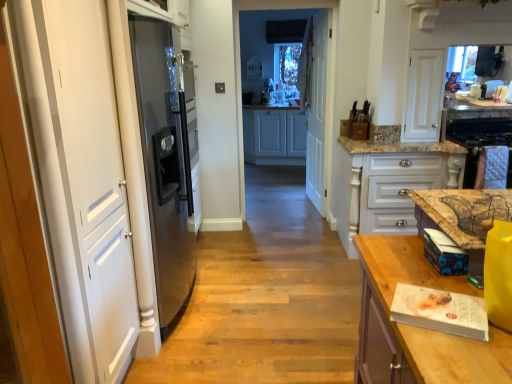
Measure the distance between brown marble countertop at right, which is the 2th countertop in bottom-to-top order, and camera.

brown marble countertop at right, which is the 2th countertop in bottom-to-top order, and camera are 1.49 meters apart from each other.

This screenshot has width=512, height=384. Describe the element at coordinates (480, 151) in the screenshot. I see `quilted fabric oven at right` at that location.

What do you see at coordinates (316, 108) in the screenshot?
I see `white wooden door at center` at bounding box center [316, 108].

Measure the distance between point (355, 219) and camera.

They are 3.46 meters apart.

You are a GUI agent. You are given a task and a screenshot of the screen. Output one action in this format:
    pyautogui.click(x=<x>, y=<y>)
    Task: Click on the brown marble countertop at right, which is the 2th countertop in bottom-to-top order
    This screenshot has height=384, width=512.
    Given the screenshot: What is the action you would take?
    pyautogui.click(x=463, y=212)

Would you say white wooden door at center is a long distance from white wood cabinets at center, the first cabinetry viewed from the left?

Yes, white wooden door at center and white wood cabinets at center, the first cabinetry viewed from the left, are quite far apart.

Considering the relative positions of white wooden door at center and white wood cabinets at center, the first cabinetry in the top-to-bottom sequence, in the image provided, is white wooden door at center behind white wood cabinets at center, the first cabinetry in the top-to-bottom sequence,?

No, white wooden door at center is in front of white wood cabinets at center, the first cabinetry in the top-to-bottom sequence.

How far apart are white wooden door at center and white wood cabinets at center, which appears as the 2th cabinetry when viewed from the front?

white wooden door at center is 1.58 meters from white wood cabinets at center, which appears as the 2th cabinetry when viewed from the front.

Does white wooden door at center have a larger size compared to white wood cabinets at center, the first cabinetry viewed from the left?

No, white wooden door at center is not bigger than white wood cabinets at center, the first cabinetry viewed from the left.

Which is behind, quilted fabric oven at right or wooden table at right, the second countertop from the top?

quilted fabric oven at right is behind.

Considering the positions of objects quilted fabric oven at right and wooden table at right, which is the 1th countertop in bottom-to-top order, in the image provided, who is more to the left, quilted fabric oven at right or wooden table at right, which is the 1th countertop in bottom-to-top order,?

From the viewer's perspective, wooden table at right, which is the 1th countertop in bottom-to-top order, appears more on the left side.

Who is bigger, quilted fabric oven at right or wooden table at right, the second countertop from the top?

With larger size is wooden table at right, the second countertop from the top.

Consider the image. From a real-world perspective, relative to wooden table at right, the second countertop from the top, is quilted fabric oven at right vertically above or below?

quilted fabric oven at right is situated higher than wooden table at right, the second countertop from the top, in the real world.

Would you consider white wood cabinets at center, marked as the 2th cabinetry in a bottom-to-top arrangement, to be distant from brown marble countertop at right, which is the 2th countertop in bottom-to-top order?

Absolutely, white wood cabinets at center, marked as the 2th cabinetry in a bottom-to-top arrangement, is distant from brown marble countertop at right, which is the 2th countertop in bottom-to-top order.

Which point is more distant from viewer, (x=258, y=161) or (x=484, y=193)?

A: Positioned behind is point (x=258, y=161).

Based on the photo, is white wood cabinets at center, the first cabinetry viewed from the left, shorter than brown marble countertop at right, which is the 2th countertop in bottom-to-top order?

Incorrect, the height of white wood cabinets at center, the first cabinetry viewed from the left, does not fall short of that of brown marble countertop at right, which is the 2th countertop in bottom-to-top order.

Can you confirm if white wood cabinets at center, which appears as the 2th cabinetry when viewed from the front, is thinner than brown marble countertop at right, the 1th countertop positioned from the top?

In fact, white wood cabinets at center, which appears as the 2th cabinetry when viewed from the front, might be wider than brown marble countertop at right, the 1th countertop positioned from the top.

From the picture: From the image's perspective, is white glossy cabinet at center, the first cabinetry positioned from the right, on top of white wood cabinets at center, marked as the 2th cabinetry in a bottom-to-top arrangement?

No, from the image's perspective, white glossy cabinet at center, the first cabinetry positioned from the right, is not on top of white wood cabinets at center, marked as the 2th cabinetry in a bottom-to-top arrangement.

Which object is positioned more to the right, white glossy cabinet at center, the first cabinetry positioned from the right, or white wood cabinets at center, the first cabinetry in the top-to-bottom sequence?

Positioned to the right is white glossy cabinet at center, the first cabinetry positioned from the right.

Is white glossy cabinet at center, which is the 1th cabinetry from front to back, not near white wood cabinets at center, which appears as the 2th cabinetry when viewed from the front?

Absolutely, white glossy cabinet at center, which is the 1th cabinetry from front to back, is distant from white wood cabinets at center, which appears as the 2th cabinetry when viewed from the front.

Considering the sizes of objects white wooden door at center and wooden table at right, which is the 1th countertop in bottom-to-top order, in the image provided, who is smaller, white wooden door at center or wooden table at right, which is the 1th countertop in bottom-to-top order,?

With smaller size is white wooden door at center.

Which is closer to the camera, (310,42) or (364,355)?

The point (364,355) is in front.

This screenshot has width=512, height=384. Identify the location of door located behind the wooden table at right, the second countertop from the top. (316, 108).

From a real-world perspective, is white wooden door at center physically located above or below brown marble countertop at right, which is the 2th countertop in bottom-to-top order?

In terms of real-world spatial position, white wooden door at center is above brown marble countertop at right, which is the 2th countertop in bottom-to-top order.

From a real-world perspective, which countertop is the 1st one underneath the white wooden door at center? Please provide its 2D coordinates.

[(463, 212)]

Does white wooden door at center come behind brown marble countertop at right, which is the 2th countertop in bottom-to-top order?

Yes.

Measure the distance from white wooden door at center to brown marble countertop at right, which is the 2th countertop in bottom-to-top order.

2.42 meters.

Which object is closer to the camera, white glossy cabinet at center, the 2th cabinetry positioned from the top, or quilted fabric oven at right?

quilted fabric oven at right is closer to the camera.

Does point (405, 151) come closer to viewer compared to point (473, 152)?

No, (405, 151) is further to viewer.

Is white glossy cabinet at center, the 2th cabinetry positioned from the top, bigger than quilted fabric oven at right?

Correct, white glossy cabinet at center, the 2th cabinetry positioned from the top, is larger in size than quilted fabric oven at right.

Could quilted fabric oven at right be considered to be inside white glossy cabinet at center, which appears as the second cabinetry when viewed from the back?

Result: That's incorrect, quilted fabric oven at right is not inside white glossy cabinet at center, which appears as the second cabinetry when viewed from the back.

Where is `door lying in front of the white wood cabinets at center, the first cabinetry viewed from the left`? This screenshot has width=512, height=384. door lying in front of the white wood cabinets at center, the first cabinetry viewed from the left is located at coordinates (316, 108).

The height and width of the screenshot is (384, 512). In order to click on the 1st countertop to the left of the quilted fabric oven at right, starting your count from the anchor in this screenshot , I will do `click(416, 327)`.

From the image, which object appears to be nearer to quilted fabric oven at right, white wood cabinets at center, which appears as the 2th cabinetry when viewed from the front, or white wooden door at center?

The object closer to quilted fabric oven at right is white wooden door at center.

In the scene shown: Looking at the image, which one is located closer to wooden table at right, the second countertop from the top, white wooden door at center or brown marble countertop at right, which is the 2th countertop in bottom-to-top order?

Among the two, brown marble countertop at right, which is the 2th countertop in bottom-to-top order, is located nearer to wooden table at right, the second countertop from the top.

When comparing their distances from white wooden door at center, does brown marble countertop at right, which is the 2th countertop in bottom-to-top order, or white glossy cabinet at center, the first cabinetry positioned from the right, seem further?

brown marble countertop at right, which is the 2th countertop in bottom-to-top order, is further to white wooden door at center.

Which object lies further to the anchor point white wood cabinets at center, which appears as the second cabinetry when viewed from the right, quilted fabric oven at right or white wooden door at center?

Based on the image, quilted fabric oven at right appears to be further to white wood cabinets at center, which appears as the second cabinetry when viewed from the right.

Estimate the real-world distances between objects in this image. Which object is closer to wooden table at right, which is the 1th countertop in bottom-to-top order, brown marble countertop at right, the 1th countertop positioned from the top, or quilted fabric oven at right?

The object closer to wooden table at right, which is the 1th countertop in bottom-to-top order, is brown marble countertop at right, the 1th countertop positioned from the top.

From the picture: Based on their spatial positions, is white glossy cabinet at center, arranged as the first cabinetry when ordered from the bottom, or wooden table at right, which is the 1th countertop in bottom-to-top order, further from white wood cabinets at center, marked as the 2th cabinetry in a bottom-to-top arrangement?

The object further to white wood cabinets at center, marked as the 2th cabinetry in a bottom-to-top arrangement, is wooden table at right, which is the 1th countertop in bottom-to-top order.

From the image, which object appears to be nearer to white glossy cabinet at center, which appears as the second cabinetry when viewed from the back, wooden table at right, which is the 1th countertop in bottom-to-top order, or white wooden door at center?

The object closer to white glossy cabinet at center, which appears as the second cabinetry when viewed from the back, is white wooden door at center.

Considering their positions, is white wooden door at center positioned closer to white glossy cabinet at center, arranged as the first cabinetry when ordered from the bottom, than quilted fabric oven at right?

quilted fabric oven at right.

At what (x,y) coordinates should I click in order to perform the action: click on door positioned between quilted fabric oven at right and white wood cabinets at center, which appears as the first cabinetry when viewed from the back, from near to far. Please return your answer as a coordinate pair (x, y). The height and width of the screenshot is (384, 512). Looking at the image, I should click on (316, 108).

Where is `oven between wooden table at right, the second countertop from the top, and white glossy cabinet at center, which appears as the second cabinetry when viewed from the left, from front to back`? This screenshot has height=384, width=512. oven between wooden table at right, the second countertop from the top, and white glossy cabinet at center, which appears as the second cabinetry when viewed from the left, from front to back is located at coordinates (480, 151).

The height and width of the screenshot is (384, 512). I want to click on door between brown marble countertop at right, the 1th countertop positioned from the top, and white wood cabinets at center, which appears as the 2th cabinetry when viewed from the front, from front to back, so click(316, 108).

The height and width of the screenshot is (384, 512). I want to click on cabinetry between white wooden door at center and quilted fabric oven at right, so click(391, 183).